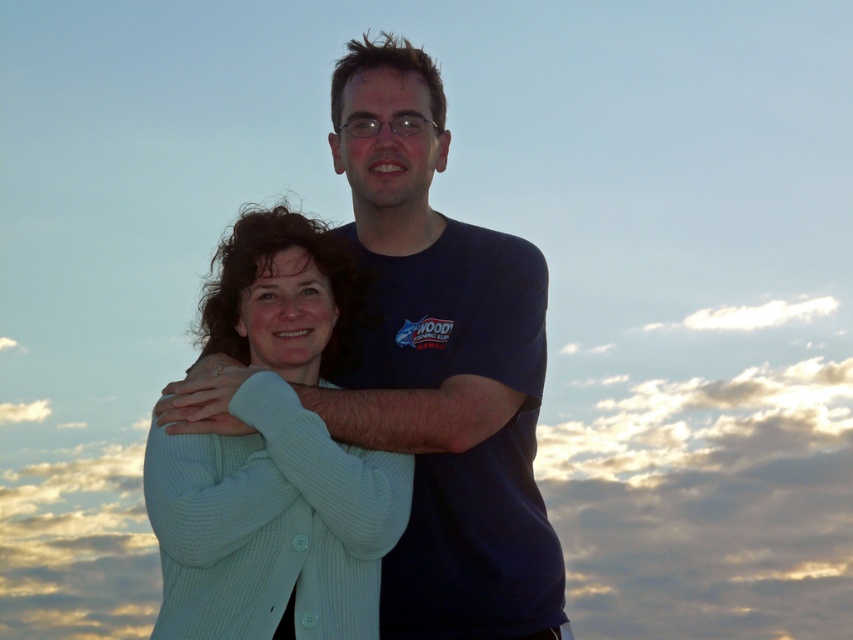
Which is more to the right, white knit sweater at center or light blue knit sweater at center?

From the viewer's perspective, white knit sweater at center appears more on the right side.

Between white knit sweater at center and light blue knit sweater at center, which one has more height?

With more height is light blue knit sweater at center.

At what (x,y) coordinates should I click in order to perform the action: click on white knit sweater at center. Please return your answer as a coordinate pair (x, y). This screenshot has width=853, height=640. Looking at the image, I should click on (442, 368).